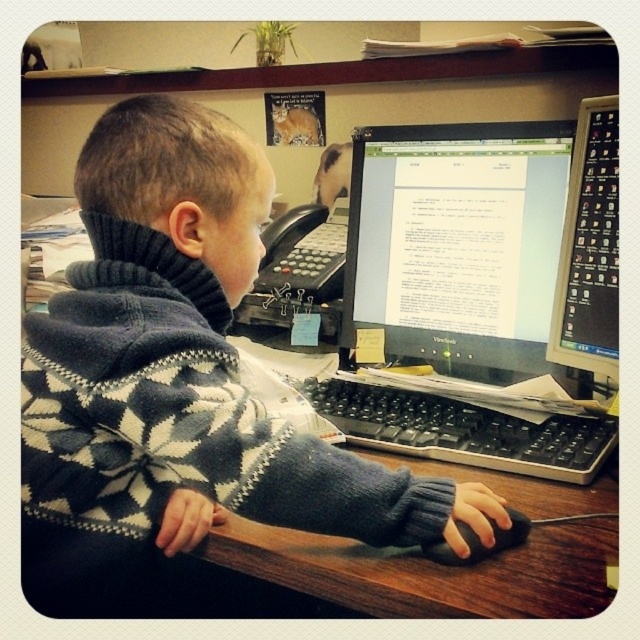
Is dark blue sweater at center to the left of black matte mouse at center from the viewer's perspective?

Yes, dark blue sweater at center is to the left of black matte mouse at center.

Is dark blue sweater at center thinner than black matte mouse at center?

No, dark blue sweater at center is not thinner than black matte mouse at center.

What do you see at coordinates (179, 394) in the screenshot? The height and width of the screenshot is (640, 640). I see `dark blue sweater at center` at bounding box center [179, 394].

This screenshot has height=640, width=640. Find the location of `dark blue sweater at center`. dark blue sweater at center is located at coordinates (179, 394).

Is black plastic keyboard at center wider than matte black monitor at right?

Indeed, black plastic keyboard at center has a greater width compared to matte black monitor at right.

Where is `black plastic keyboard at center`? black plastic keyboard at center is located at coordinates (467, 432).

I want to click on black plastic keyboard at center, so click(x=467, y=432).

Which of these two, matte black monitor at right or black matte mouse at center, stands taller?

With more height is matte black monitor at right.

Between point (572, 156) and point (433, 552), which one is positioned behind?

The point (572, 156) is more distant.

This screenshot has width=640, height=640. I want to click on matte black monitor at right, so click(589, 250).

Locate an element on the screen. Image resolution: width=640 pixels, height=640 pixels. matte black monitor at right is located at coordinates (589, 250).